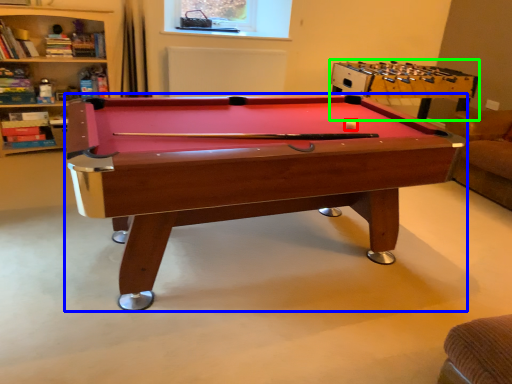
Question: Which object is positioned farthest from ball (highlighted by a red box)? Select from billiard table (highlighted by a blue box) and table (highlighted by a green box).

Choices:
 (A) billiard table
 (B) table

Answer: (B)